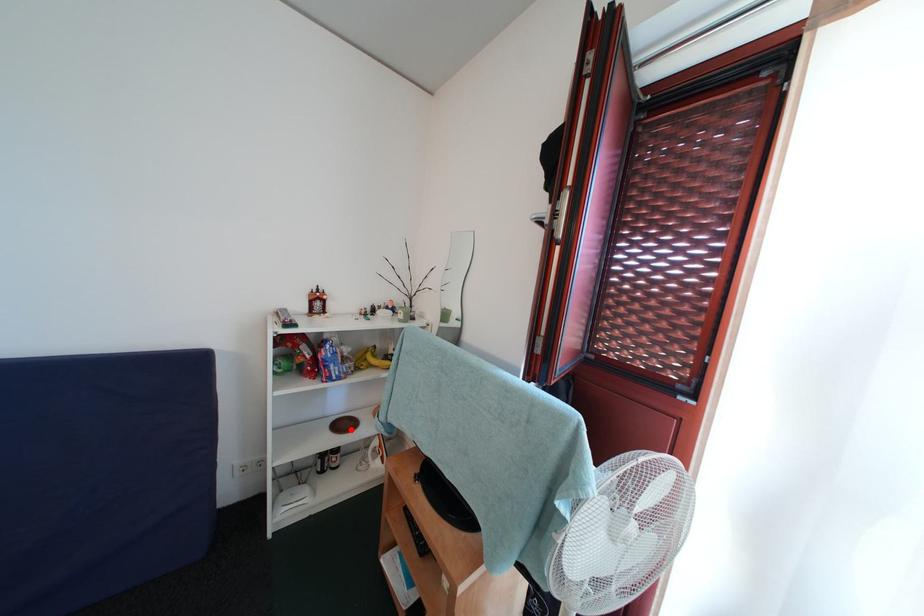
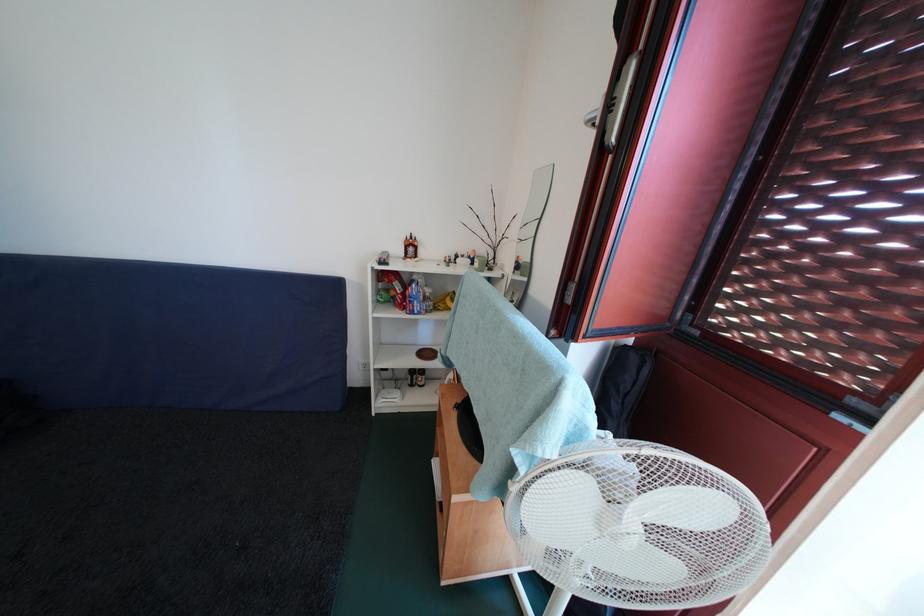
Question: I am providing you with two images of the same scene from different viewpoints. Image1 has a red point marked. In image2, the corresponding 3D location appears at what relative position? Reply with the corresponding letter.

Choices:
 (A) Closer
 (B) Farther

Answer: (B)